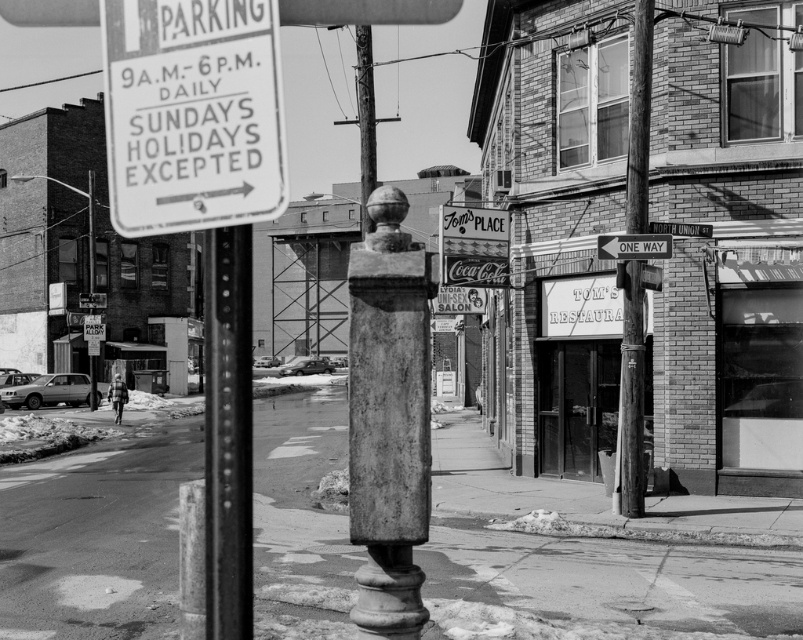
You are a delivery driver trying to navigate through this street. You see the metallic one way sign at center and the white paper street sign at upper center. Which of these two signs is narrower?

The metallic one way sign at center is narrower than the white paper street sign at upper center.